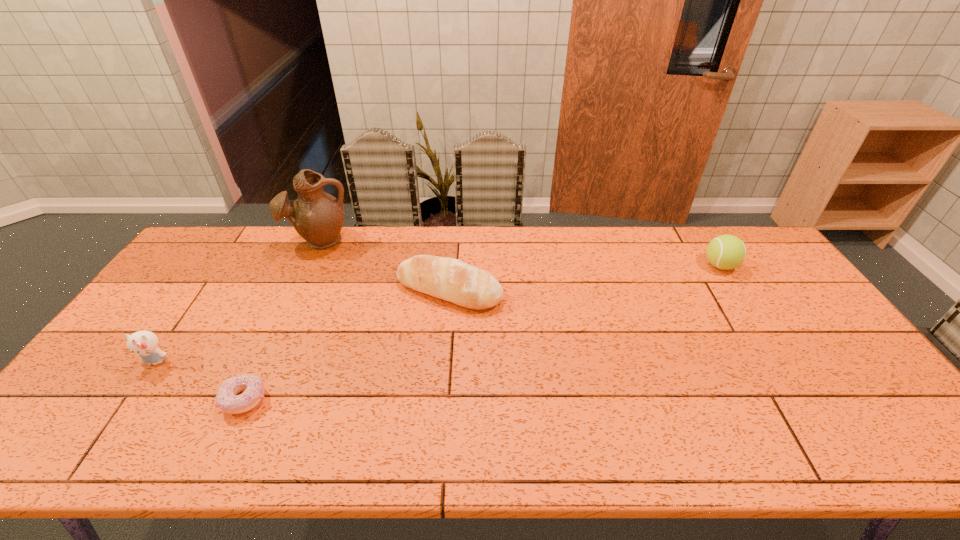
I want to click on free space between the rightmost object and the doughnut, so click(x=482, y=333).

Find the location of `empty location between the fourth object from left to right and the leftmost object`. empty location between the fourth object from left to right and the leftmost object is located at coordinates (302, 326).

The height and width of the screenshot is (540, 960). Identify the location of object that stands as the second closest to the second object from right to left. (252, 386).

Select which object appears as the second closest to the fourth object from left to right. Please provide its 2D coordinates. Your answer should be formatted as a tuple, i.e. [(x, y)], where the tuple contains the x and y coordinates of a point satisfying the conditions above.

[(252, 386)]

Locate an element on the screen. vacant point that satisfies the following two spatial constraints: 1. at the spout of the pitcher; 2. on the left side of the tennis ball is located at coordinates (308, 266).

At what (x,y) coordinates should I click in order to perform the action: click on vacant space that satisfies the following two spatial constraints: 1. at the spout of the pitcher; 2. on the right side of the tennis ball. Please return your answer as a coordinate pair (x, y). Looking at the image, I should click on (308, 266).

Find the location of `blank area in the image that satisfies the following two spatial constraints: 1. on the back side of the nearest object; 2. on the right side of the bread`. blank area in the image that satisfies the following two spatial constraints: 1. on the back side of the nearest object; 2. on the right side of the bread is located at coordinates (296, 290).

What are the coordinates of `free space that satisfies the following two spatial constraints: 1. on the back side of the bread; 2. on the right side of the nearest object` in the screenshot? It's located at (296, 290).